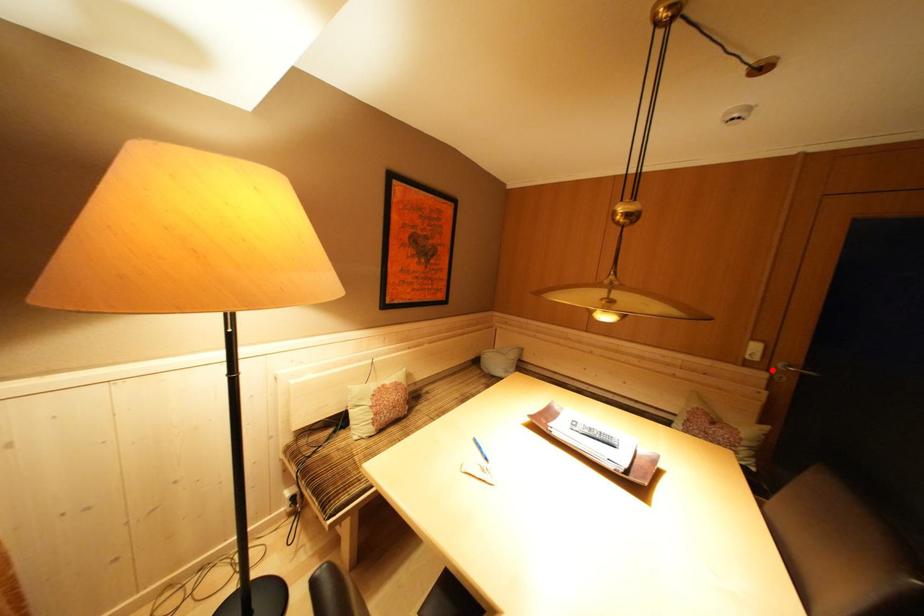
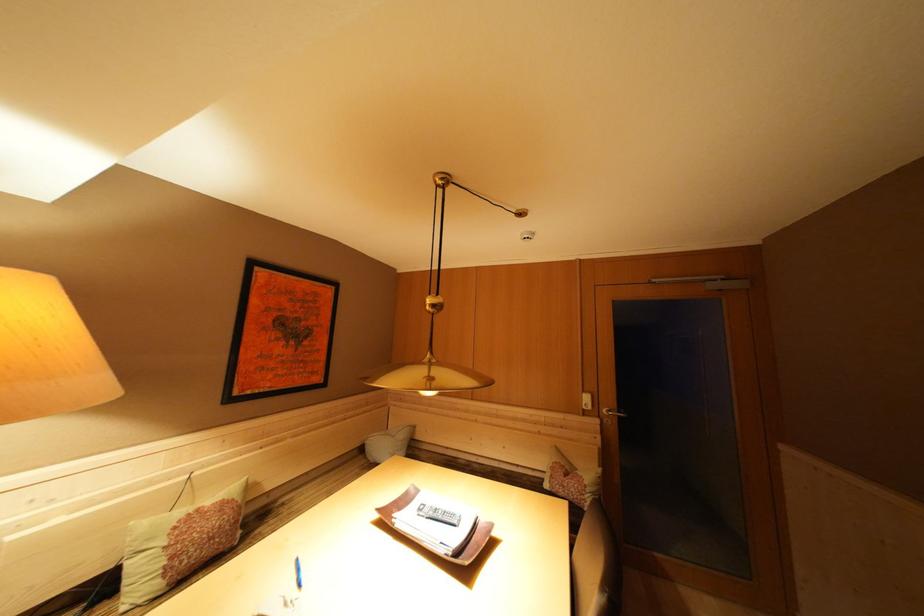
Locate, in the second image, the point that corresponds to the highlighted location in the first image.

(602, 418)